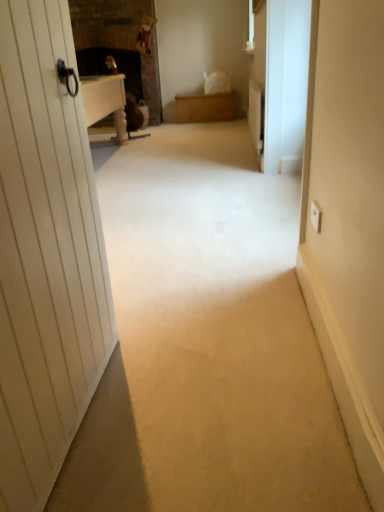
Locate an element on the screen. white matte screen door at right is located at coordinates (286, 84).

Where is `polished brass door handle at upper left`? This screenshot has height=512, width=384. polished brass door handle at upper left is located at coordinates (67, 77).

Between wooden chest at center and polished brass door handle at upper left, which one has less height?

With less height is wooden chest at center.

From a real-world perspective, who is located lower, wooden chest at center or polished brass door handle at upper left?

In real-world perspective, wooden chest at center is lower.

Which object is positioned more to the left, wooden chest at center or polished brass door handle at upper left?

Positioned to the left is polished brass door handle at upper left.

How distant is wooden chest at center from polished brass door handle at upper left?

wooden chest at center is 15.93 feet away from polished brass door handle at upper left.

Find the location of `screen door that appears below the polished brass door handle at upper left (from the image's perspective)`. screen door that appears below the polished brass door handle at upper left (from the image's perspective) is located at coordinates (286, 84).

From the image's perspective, is polished brass door handle at upper left below white matte screen door at right?

No.

Who is bigger, polished brass door handle at upper left or white matte screen door at right?

white matte screen door at right is bigger.

Which is more to the left, polished brass door handle at upper left or white matte screen door at right?

polished brass door handle at upper left.

Identify the location of furniture that appears behind the white matte screen door at right. (205, 106).

Who is taller, white matte screen door at right or wooden chest at center?

Standing taller between the two is white matte screen door at right.

Between white matte screen door at right and wooden chest at center, which one has larger width?

Wider between the two is wooden chest at center.

Could you tell me if white matte screen door at right is turned towards wooden chest at center?

No, white matte screen door at right is not facing towards wooden chest at center.

In terms of width, does wooden chest at center look wider or thinner when compared to white matte screen door at right?

wooden chest at center is wider than white matte screen door at right.

Looking at the image, does wooden chest at center seem bigger or smaller compared to white matte screen door at right?

Clearly, wooden chest at center is larger in size than white matte screen door at right.

Is wooden chest at center oriented away from white matte screen door at right?

No, wooden chest at center is not facing the opposite direction of white matte screen door at right.

Consider the image. Is wooden chest at center situated inside white matte screen door at right or outside?

wooden chest at center is spatially situated outside white matte screen door at right.

Which object is closer to the camera, white matte screen door at right or polished brass door handle at upper left?

white matte screen door at right is more forward.

Looking at the image, does white matte screen door at right seem bigger or smaller compared to polished brass door handle at upper left?

In the image, white matte screen door at right appears to be larger than polished brass door handle at upper left.

The image size is (384, 512). I want to click on door handle behind the white matte screen door at right, so click(x=67, y=77).

Looking at their sizes, would you say white matte screen door at right is wider or thinner than polished brass door handle at upper left?

Clearly, white matte screen door at right has less width compared to polished brass door handle at upper left.

Would you say polished brass door handle at upper left is outside wooden chest at center?

That's correct, polished brass door handle at upper left is outside of wooden chest at center.

Could you tell me if polished brass door handle at upper left is turned towards wooden chest at center?

Yes, polished brass door handle at upper left is facing wooden chest at center.

Which object is further away from the camera taking this photo, polished brass door handle at upper left or wooden chest at center?

Positioned behind is polished brass door handle at upper left.

From their relative heights in the image, would you say polished brass door handle at upper left is taller or shorter than wooden chest at center?

Clearly, polished brass door handle at upper left is taller compared to wooden chest at center.

Find the location of `door handle above the wooden chest at center (from a real-world perspective)`. door handle above the wooden chest at center (from a real-world perspective) is located at coordinates (67, 77).

What are the coordinates of `door handle above the white matte screen door at right (from the image's perspective)` in the screenshot? It's located at (67, 77).

Estimate the real-world distances between objects in this image. Which object is further from white matte screen door at right, wooden chest at center or polished brass door handle at upper left?

wooden chest at center lies further to white matte screen door at right than the other object.

Which object lies nearer to the anchor point polished brass door handle at upper left, white matte screen door at right or wooden chest at center?

Among the two, white matte screen door at right is located nearer to polished brass door handle at upper left.

Which object lies further to the anchor point wooden chest at center, white matte screen door at right or polished brass door handle at upper left?

polished brass door handle at upper left is positioned further to the anchor wooden chest at center.

Considering their positions, is polished brass door handle at upper left positioned closer to wooden chest at center than white matte screen door at right?

Based on the image, white matte screen door at right appears to be nearer to wooden chest at center.

From the image, which object appears to be farther from white matte screen door at right, polished brass door handle at upper left or wooden chest at center?

wooden chest at center is positioned further to the anchor white matte screen door at right.

Based on the photo, which object lies nearer to the anchor point polished brass door handle at upper left, wooden chest at center or white matte screen door at right?

Based on the image, white matte screen door at right appears to be nearer to polished brass door handle at upper left.

Where is `furniture between white matte screen door at right and polished brass door handle at upper left along the z-axis`? The image size is (384, 512). furniture between white matte screen door at right and polished brass door handle at upper left along the z-axis is located at coordinates (205, 106).